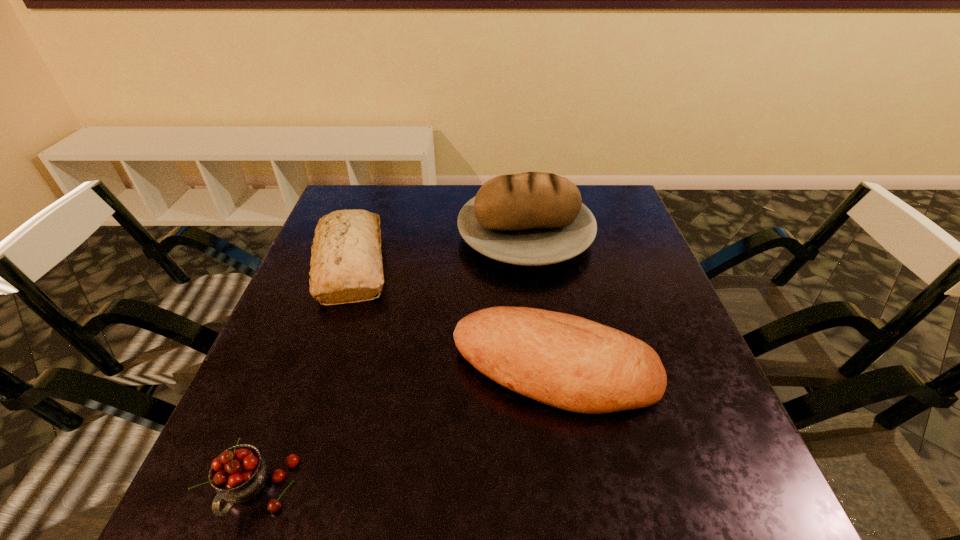
Locate an element on the screen. The width and height of the screenshot is (960, 540). cherry located in the left edge section of the desktop is located at coordinates (238, 474).

You are a GUI agent. You are given a task and a screenshot of the screen. Output one action in this format:
    pyautogui.click(x=<x>, y=<y>)
    Task: Click on the object at the near left corner
    This screenshot has width=960, height=540.
    Given the screenshot: What is the action you would take?
    pyautogui.click(x=238, y=474)

Where is `object located in the far right corner section of the desktop`? The image size is (960, 540). object located in the far right corner section of the desktop is located at coordinates (533, 218).

Image resolution: width=960 pixels, height=540 pixels. Find the location of `free spot at the far edge of the desktop`. free spot at the far edge of the desktop is located at coordinates (445, 188).

Where is `free space at the left edge of the desktop`? free space at the left edge of the desktop is located at coordinates (234, 409).

In the image, there is a desktop. Identify the location of vacant region at the right edge. The height and width of the screenshot is (540, 960). [x=643, y=241].

Locate an element on the screen. free location at the far left corner is located at coordinates (371, 208).

Identify the location of free space between the nearest bread and the leftmost bread. This screenshot has width=960, height=540. (453, 317).

Find the location of a particular element. free spot between the tallest bread and the third farthest object is located at coordinates [540, 302].

Image resolution: width=960 pixels, height=540 pixels. In order to click on free space between the cherry and the leftmost bread in this screenshot , I will do `click(304, 377)`.